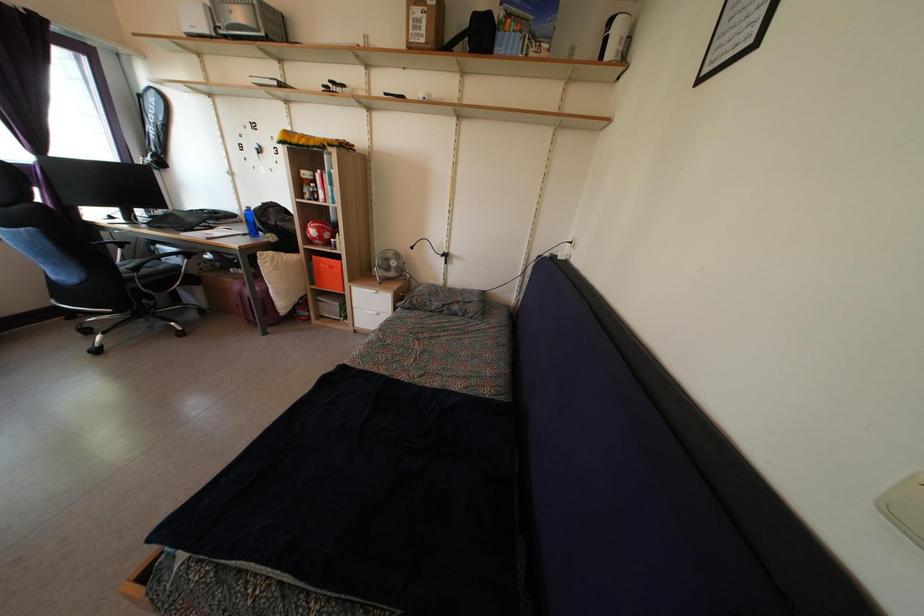
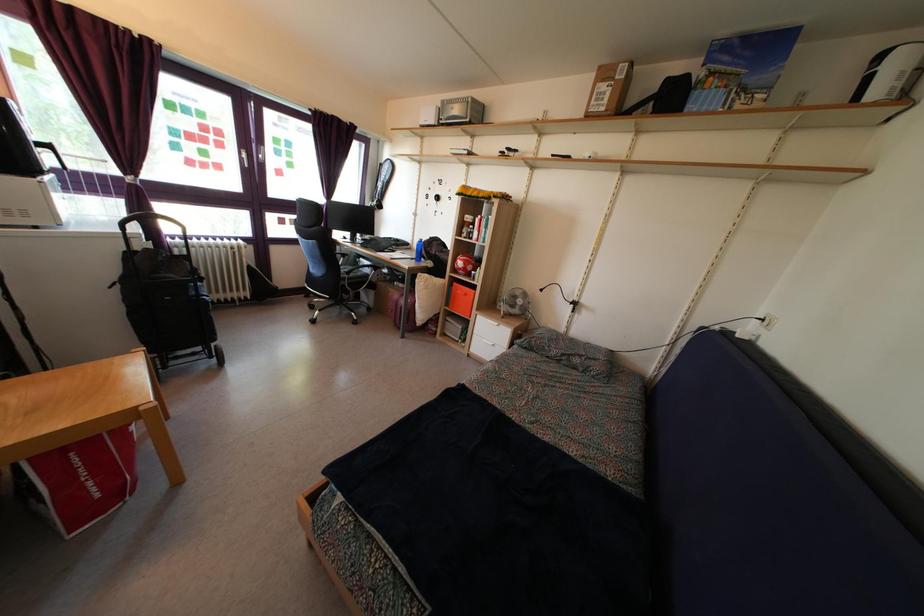
Where in the second image is the point corresponding to (334,276) from the first image?

(468, 302)